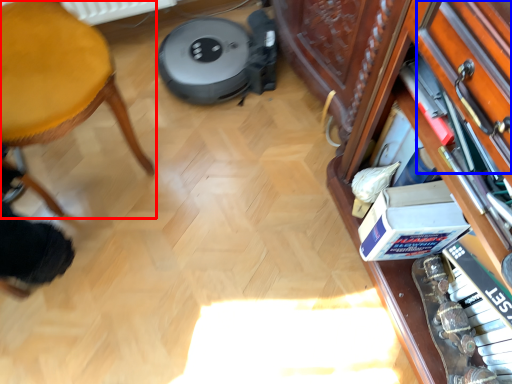
Question: Among these objects, which one is farthest to the camera, furniture (highlighted by a red box) or drawer (highlighted by a blue box)?

Choices:
 (A) furniture
 (B) drawer

Answer: (B)